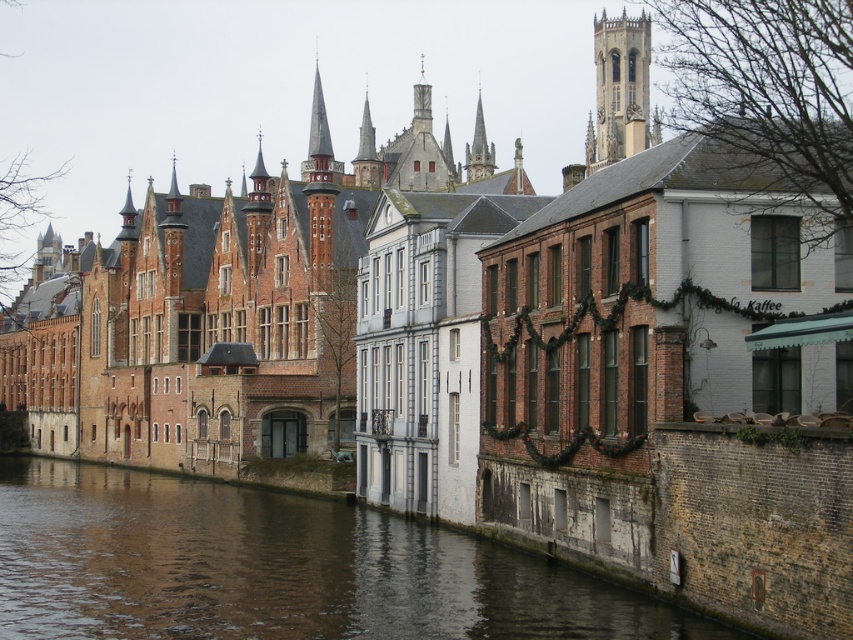
You are a tourist standing at the edge of the canal, facing the buildings. You notice the stone clock tower at upper right and the gray stone tower at center. Which tower is located to the right of the other?

The stone clock tower at upper right is positioned on the right side of the gray stone tower at center, so the stone clock tower at upper right is to the right of the gray stone tower at center.

In the canal scene, there is a gray stone tower at center and a smooth gray stone spire at center. Which of these two structures is larger in size?

The gray stone tower at center is smaller than the smooth gray stone spire at center, so the smooth gray stone spire at center is larger in size.

You are standing at the edge of the canal and want to determine the relative positions of two points in the scene. Which point is closer to you, point (634,80) or point (438,154)?

Point (634,80) is closer to you because it is further to the viewer than point (438,154).